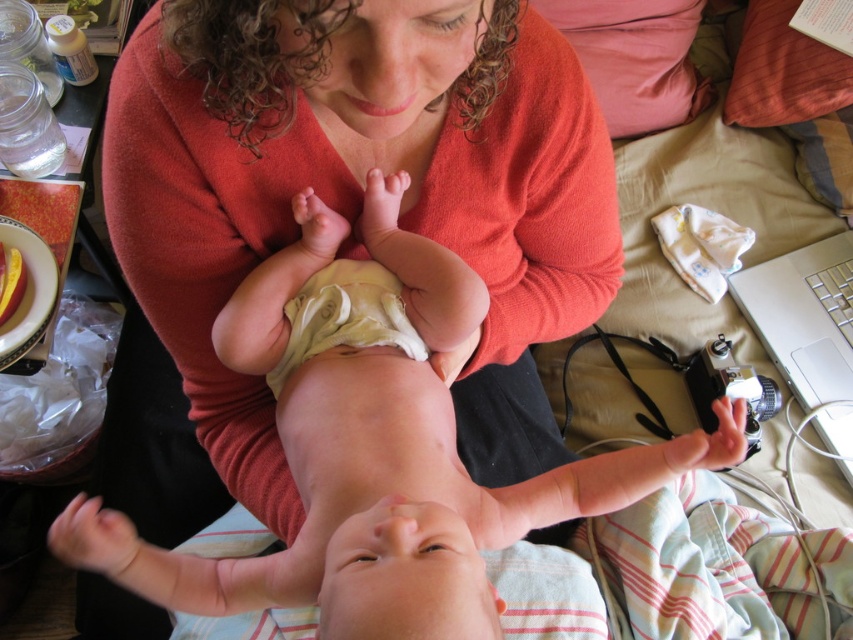
Can you confirm if matte orange sweater at center is wider than soft beige diaper at center?

Incorrect, matte orange sweater at center's width does not surpass soft beige diaper at center's.

Does matte orange sweater at center come behind soft beige diaper at center?

No, it is not.

Describe the element at coordinates (361, 195) in the screenshot. I see `matte orange sweater at center` at that location.

Find the location of a particular element. The height and width of the screenshot is (640, 853). matte orange sweater at center is located at coordinates (361, 195).

Which is above, soft beige diaper at center or light yellow cloth diaper at center?

light yellow cloth diaper at center

Does soft beige diaper at center have a smaller size compared to light yellow cloth diaper at center?

No.

Is point (676, 458) farther from viewer compared to point (351, 278)?

No, (676, 458) is in front of (351, 278).

The height and width of the screenshot is (640, 853). I want to click on soft beige diaper at center, so click(374, 449).

Is point (840, 289) closer to viewer compared to point (314, 301)?

No, it is not.

Between silver metallic laptop at lower right and light yellow cloth diaper at center, which one has less height?

Standing shorter between the two is light yellow cloth diaper at center.

Where is `silver metallic laptop at lower right`? Image resolution: width=853 pixels, height=640 pixels. silver metallic laptop at lower right is located at coordinates (808, 332).

Locate an element on the screen. The height and width of the screenshot is (640, 853). silver metallic laptop at lower right is located at coordinates (808, 332).